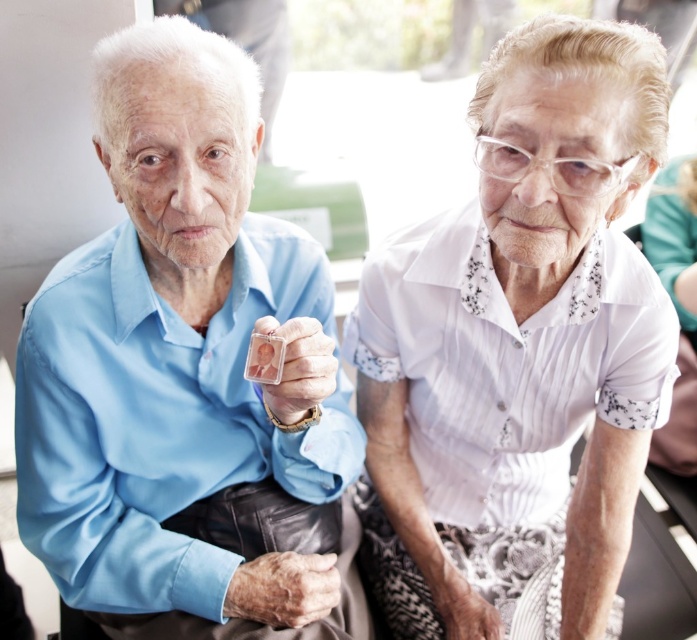
Question: Among these points, which one is nearest to the camera?

Choices:
 (A) [576, 54]
 (B) [337, 577]

Answer: (A)

Question: From the image, what is the correct spatial relationship of matte blue shirt at center in relation to white textured blouse at upper right?

Choices:
 (A) below
 (B) above

Answer: (A)

Question: Is the position of matte blue shirt at center more distant than that of white textured blouse at upper right?

Choices:
 (A) yes
 (B) no

Answer: (A)

Question: Which point is farther to the camera?

Choices:
 (A) (599, 442)
 (B) (148, 580)

Answer: (A)

Question: Observing the image, what is the correct spatial positioning of matte blue shirt at center in reference to white textured blouse at upper right?

Choices:
 (A) right
 (B) left

Answer: (B)